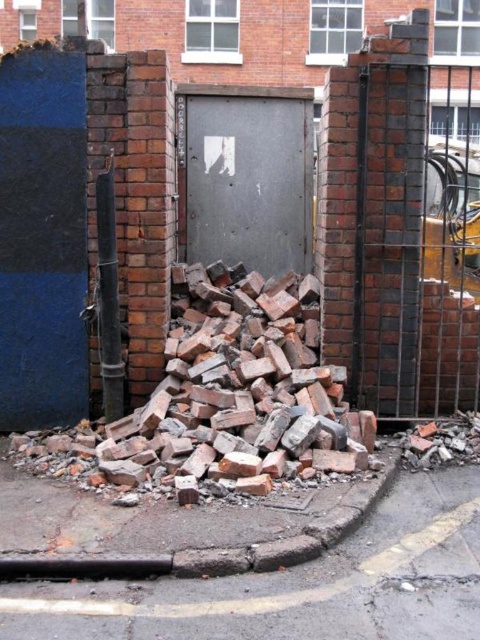
Which is below, brick rubble at lower center or metallic gray door at center?

brick rubble at lower center is below.

Does brick rubble at lower center have a larger size compared to metallic gray door at center?

Yes, brick rubble at lower center is bigger than metallic gray door at center.

At what (x,y) coordinates should I click in order to perform the action: click on brick rubble at lower center. Please return your answer as a coordinate pair (x, y). Looking at the image, I should click on (223, 401).

Is brown rough bricks at center thinner than brown rough pavement at lower left?

No.

The height and width of the screenshot is (640, 480). I want to click on brown rough bricks at center, so click(307, 180).

Find the location of a particular element. The image size is (480, 640). brown rough bricks at center is located at coordinates (307, 180).

Is point (409, 342) positioned behind point (365, 452)?

That is True.

Looking at this image, is brown rough bricks at center in front of brick rubble at lower center?

No, brown rough bricks at center is behind brick rubble at lower center.

Identify the location of brown rough bricks at center. (307, 180).

Find the location of a particular element. The width and height of the screenshot is (480, 640). brown rough bricks at center is located at coordinates (307, 180).